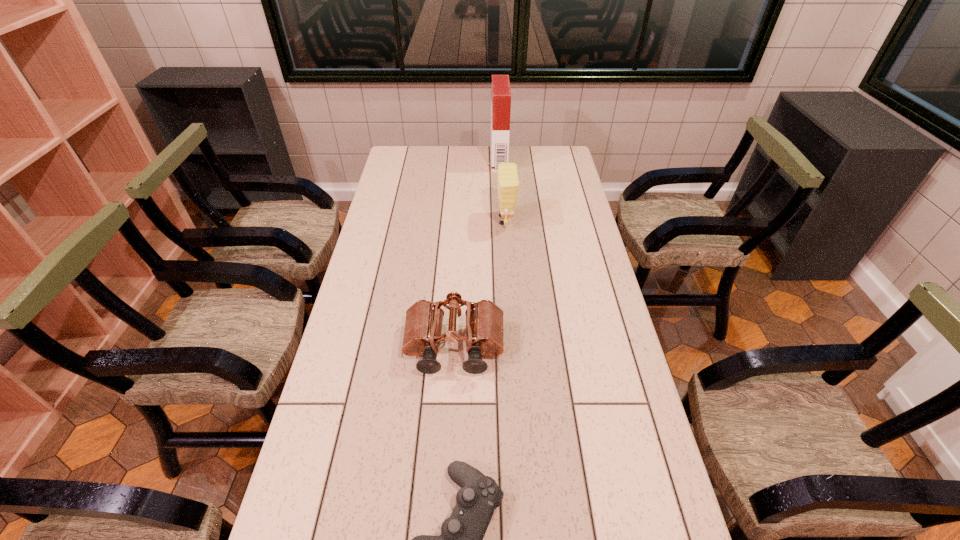
The width and height of the screenshot is (960, 540). I want to click on free space located 0.260m on the face of the sponge, so click(424, 220).

Where is `free point located on the face of the sponge`? free point located on the face of the sponge is located at coordinates (469, 220).

Where is `free spot located through the eyepieces of the binoculars`? The height and width of the screenshot is (540, 960). free spot located through the eyepieces of the binoculars is located at coordinates (451, 414).

Where is `object that is at the far edge`? object that is at the far edge is located at coordinates (501, 93).

Identify the location of free space at the far edge. (454, 166).

I want to click on vacant space at the left edge of the desktop, so click(390, 244).

Find the location of a particular element. The image size is (960, 540). free location at the right edge is located at coordinates (638, 413).

This screenshot has width=960, height=540. In order to click on free space at the far left corner in this screenshot , I will do 400,157.

Where is `blank space at the far right corner of the desktop`? Image resolution: width=960 pixels, height=540 pixels. blank space at the far right corner of the desktop is located at coordinates (556, 161).

Where is `empty location between the third nearest object and the third tallest object`? The image size is (960, 540). empty location between the third nearest object and the third tallest object is located at coordinates (479, 284).